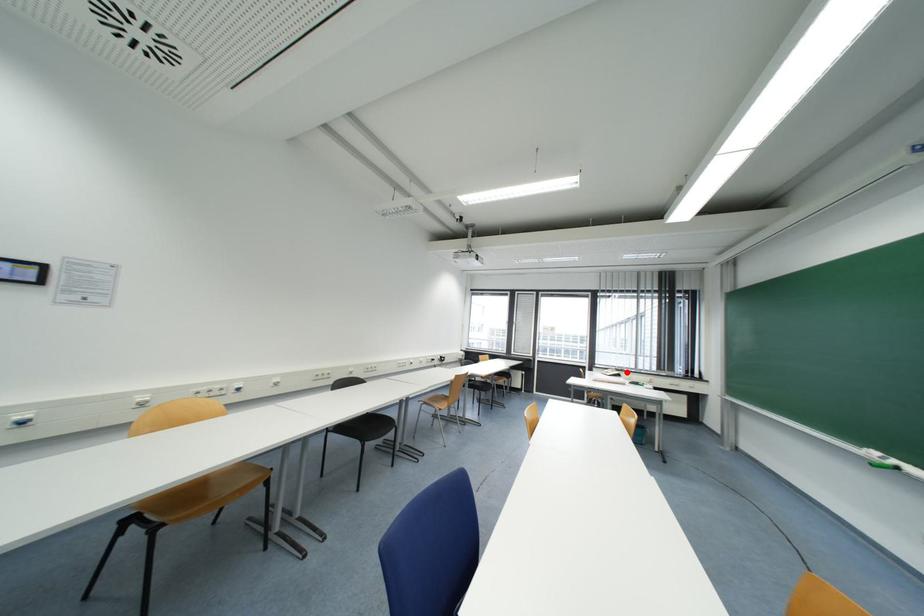
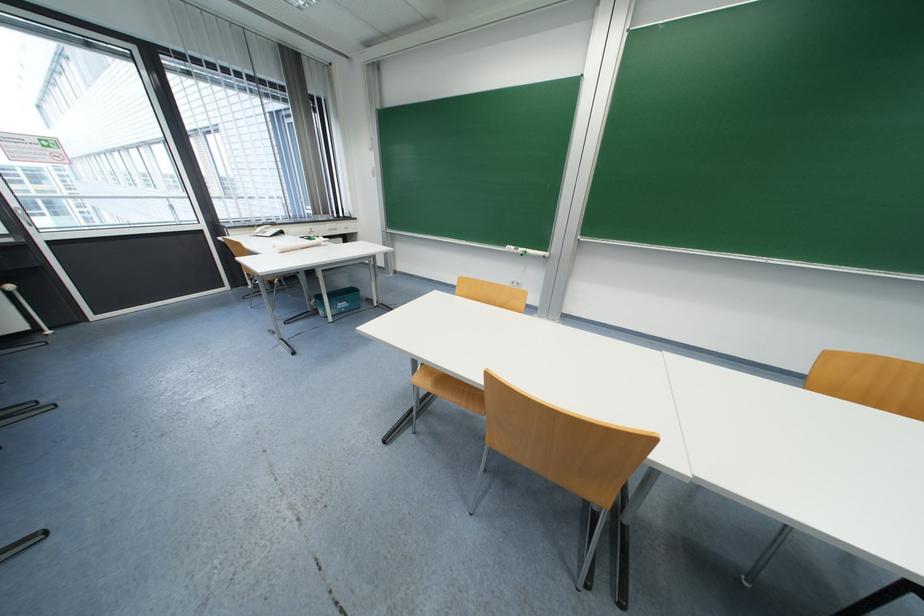
Question: I am providing you with two images of the same scene from different viewpoints. Given a red point in image1, look at the same physical point in image2. Is it:

Choices:
 (A) Closer to the viewpoint
 (B) Farther from the viewpoint

Answer: (A)